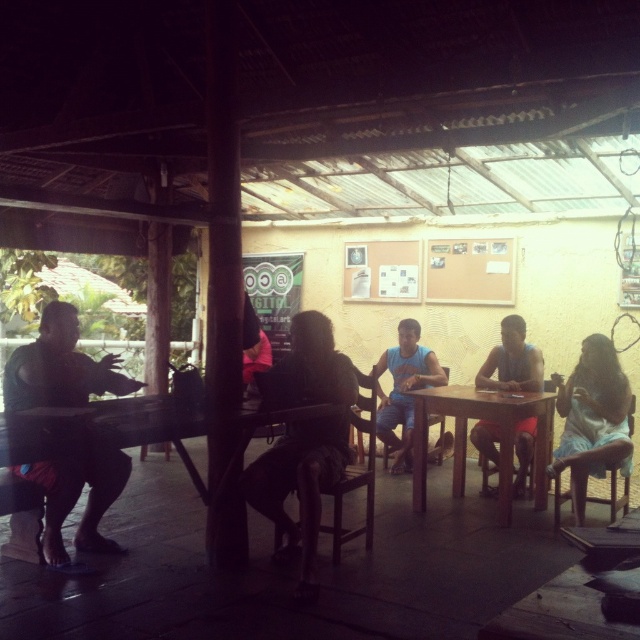
Question: Is matte black shirt at left above blue fabric shirt at center?

Choices:
 (A) yes
 (B) no

Answer: (B)

Question: Among these points, which one is farthest from the camera?

Choices:
 (A) (458, 442)
 (B) (224, 499)

Answer: (A)

Question: Observing the image, what is the correct spatial positioning of matte black shirt at left in reference to light blue fabric dress at lower right?

Choices:
 (A) below
 (B) above

Answer: (A)

Question: Does dark brown leather chair at center appear under matte blue tank top at center?

Choices:
 (A) yes
 (B) no

Answer: (A)

Question: Estimate the real-world distances between objects in this image. Which object is farther from the wooden table at center?

Choices:
 (A) dark brown leather chair at center
 (B) matte pink shirt at center
 (C) blue fabric shirt at center

Answer: (B)

Question: Which point appears closest to the camera in this image?

Choices:
 (A) (612, 452)
 (B) (12, 352)

Answer: (A)